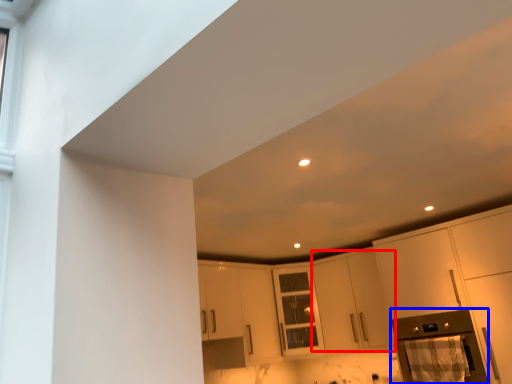
Question: Which point is closer to the camera, cabinetry (highlighted by a red box) or appliance (highlighted by a blue box)?

Choices:
 (A) cabinetry
 (B) appliance

Answer: (B)